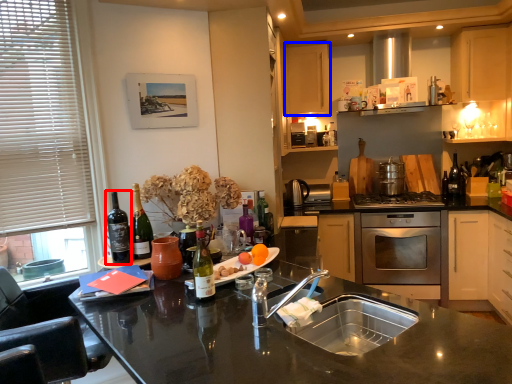
Question: Which point is further to the camera, wine (highlighted by a red box) or cabinetry (highlighted by a blue box)?

Choices:
 (A) wine
 (B) cabinetry

Answer: (B)